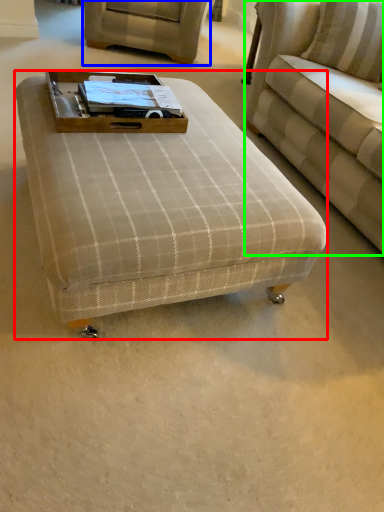
Question: Based on their relative distances, which object is nearer to table (highlighted by a red box)? Choose from swivel chair (highlighted by a blue box) and studio couch (highlighted by a green box).

Choices:
 (A) swivel chair
 (B) studio couch

Answer: (B)